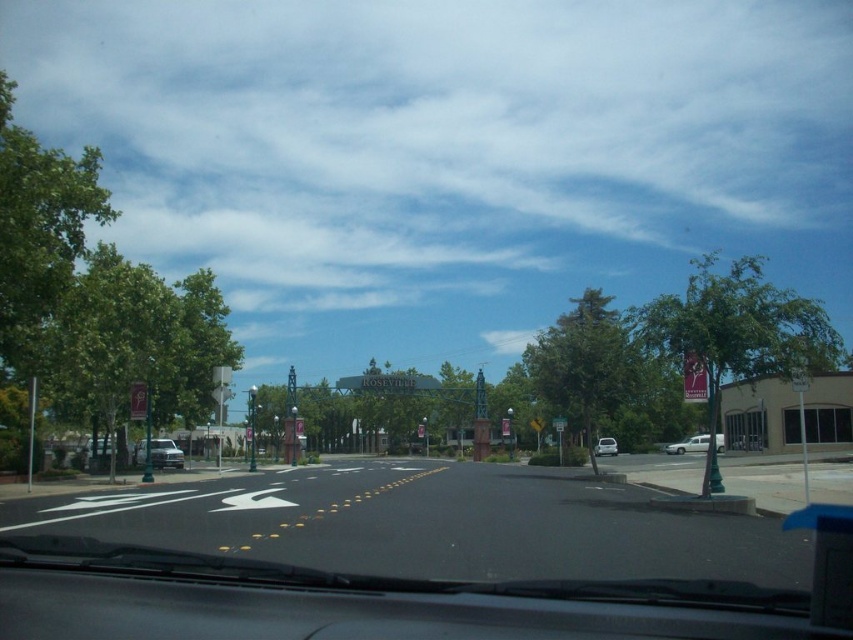
Is white glossy van at center-right closer to camera compared to white glossy sedan at center?

Yes, white glossy van at center-right is closer to the viewer.

Which is behind, point (718, 442) or point (608, 442)?

Point (608, 442)

Locate an element on the screen. white glossy van at center-right is located at coordinates (689, 444).

Which is below, silver metallic truck at center or white glossy sedan at center?

Positioned lower is white glossy sedan at center.

Between silver metallic truck at center and white glossy sedan at center, which one appears on the left side from the viewer's perspective?

Positioned to the left is silver metallic truck at center.

Between point (173, 467) and point (612, 451), which one is positioned in front?

Positioned in front is point (173, 467).

You are a GUI agent. You are given a task and a screenshot of the screen. Output one action in this format:
    pyautogui.click(x=<x>, y=<y>)
    Task: Click on the silver metallic truck at center
    
    Given the screenshot: What is the action you would take?
    tap(160, 452)

I want to click on silver metallic truck at center, so click(x=160, y=452).

Can you confirm if silver metallic truck at center is taller than white glossy van at center-right?

Incorrect, silver metallic truck at center's height is not larger of white glossy van at center-right's.

This screenshot has height=640, width=853. In order to click on silver metallic truck at center in this screenshot , I will do `click(160, 452)`.